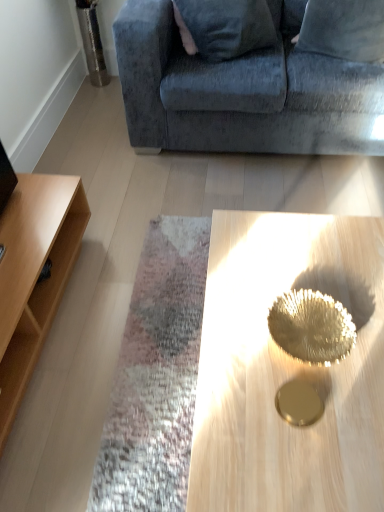
At what (x,y) coordinates should I click in order to perform the action: click on velvet blue couch at upper center. Please return your answer as a coordinate pair (x, y). The height and width of the screenshot is (512, 384). Looking at the image, I should click on (242, 94).

I want to click on velvet blue pillow at upper right, so click(x=344, y=29).

Considering the relative positions of velvet blue pillow at upper right and velvet blue couch at upper center in the image provided, is velvet blue pillow at upper right in front of velvet blue couch at upper center?

No, the depth of velvet blue pillow at upper right is greater than that of velvet blue couch at upper center.

From a real-world perspective, who is located higher, velvet blue pillow at upper right or velvet blue couch at upper center?

In real-world perspective, velvet blue pillow at upper right is above.

Which is correct: velvet blue pillow at upper right is inside velvet blue couch at upper center, or outside of it?

The correct answer is: inside.

Is velvet blue couch at upper center at the back of velvet blue pillow at upper right?

That's right, velvet blue pillow at upper right is facing away from velvet blue couch at upper center.

Who is more distant, gold metallic tray at center or velvet blue couch at upper center?

velvet blue couch at upper center is more distant.

From a real-world perspective, who is located lower, gold metallic tray at center or velvet blue couch at upper center?

From a 3D spatial view, gold metallic tray at center is below.

Find the location of a particular element. The width and height of the screenshot is (384, 512). studio couch above the gold metallic tray at center (from a real-world perspective) is located at coordinates (242, 94).

Does point (378, 258) come closer to viewer compared to point (214, 75)?

Yes, it is.

Which of these two, light wood shelf at left or velvet blue couch at upper center, is thinner?

light wood shelf at left is thinner.

Is light wood shelf at left spatially inside velvet blue couch at upper center, or outside of it?

light wood shelf at left lies outside velvet blue couch at upper center.

Is light wood shelf at left next to velvet blue couch at upper center and touching it?

No, light wood shelf at left is not beside velvet blue couch at upper center.

Is velvet blue pillow at upper right at the left side of gold metallic tray at center?

In fact, velvet blue pillow at upper right is to the right of gold metallic tray at center.

Between velvet blue pillow at upper right and gold metallic tray at center, which one has smaller size?

Smaller between the two is velvet blue pillow at upper right.

From a real-world perspective, which is physically below, velvet blue pillow at upper right or gold metallic tray at center?

gold metallic tray at center.

Is there a large distance between gold metallic tray at center and light wood shelf at left?

gold metallic tray at center is actually quite close to light wood shelf at left.

Considering the relative positions of gold metallic tray at center and light wood shelf at left in the image provided, is gold metallic tray at center to the right of light wood shelf at left from the viewer's perspective?

Yes, gold metallic tray at center is to the right of light wood shelf at left.

Considering the relative sizes of gold metallic tray at center and light wood shelf at left in the image provided, is gold metallic tray at center bigger than light wood shelf at left?

Yes.

From the picture: Which is in front, gold metallic tray at center or light wood shelf at left?

Positioned in front is gold metallic tray at center.

Does velvet blue couch at upper center have a larger size compared to light wood shelf at left?

Yes, velvet blue couch at upper center is bigger than light wood shelf at left.

Is velvet blue couch at upper center facing away from light wood shelf at left?

velvet blue couch at upper center is not turned away from light wood shelf at left.

Is velvet blue couch at upper center positioned behind light wood shelf at left?

Yes.

Considering the sizes of light wood shelf at left and velvet blue pillow at upper right in the image, is light wood shelf at left taller or shorter than velvet blue pillow at upper right?

Clearly, light wood shelf at left is shorter compared to velvet blue pillow at upper right.

Is light wood shelf at left surrounding velvet blue pillow at upper right?

No, velvet blue pillow at upper right is located outside of light wood shelf at left.

Considering the relative sizes of light wood shelf at left and velvet blue pillow at upper right in the image provided, is light wood shelf at left wider than velvet blue pillow at upper right?

Yes, light wood shelf at left is wider than velvet blue pillow at upper right.

Is light wood shelf at left closer to the viewer compared to velvet blue pillow at upper right?

Yes, it is.

You are a GUI agent. You are given a task and a screenshot of the screen. Output one action in this format:
    pyautogui.click(x=<x>, y=<y>)
    Task: Click on the pillow below the velvet blue couch at upper center (from the image's perspective)
    This screenshot has height=512, width=384.
    Given the screenshot: What is the action you would take?
    pyautogui.click(x=344, y=29)

Find the location of a particular element. This screenshot has width=384, height=512. coffee table on the left of velvet blue couch at upper center is located at coordinates (288, 368).

Based on the photo, based on their spatial positions, is gold metallic tray at center or light wood shelf at left further from velvet blue pillow at upper right?

light wood shelf at left is positioned further to the anchor velvet blue pillow at upper right.

Which object lies nearer to the anchor point velvet blue pillow at upper right, velvet blue couch at upper center or light wood shelf at left?

velvet blue couch at upper center.

From the image, which object appears to be farther from light wood shelf at left, velvet blue couch at upper center or velvet blue pillow at upper right?

velvet blue pillow at upper right is further to light wood shelf at left.

From the image, which object appears to be nearer to gold metallic tray at center, velvet blue couch at upper center or light wood shelf at left?

Based on the image, light wood shelf at left appears to be nearer to gold metallic tray at center.

Considering their positions, is light wood shelf at left positioned further to velvet blue couch at upper center than gold metallic tray at center?

gold metallic tray at center.

Based on their spatial positions, is light wood shelf at left or velvet blue pillow at upper right further from gold metallic tray at center?

velvet blue pillow at upper right lies further to gold metallic tray at center than the other object.

Considering their positions, is velvet blue pillow at upper right positioned closer to light wood shelf at left than velvet blue couch at upper center?

Based on the image, velvet blue couch at upper center appears to be nearer to light wood shelf at left.

Considering their positions, is gold metallic tray at center positioned further to velvet blue couch at upper center than velvet blue pillow at upper right?

gold metallic tray at center lies further to velvet blue couch at upper center than the other object.

Identify the location of studio couch located between light wood shelf at left and velvet blue pillow at upper right in the left-right direction. Image resolution: width=384 pixels, height=512 pixels. (242, 94).

Where is `pillow between velvet blue couch at upper center and gold metallic tray at center in the up-down direction`? The width and height of the screenshot is (384, 512). pillow between velvet blue couch at upper center and gold metallic tray at center in the up-down direction is located at coordinates (344, 29).

In order to click on table between velvet blue pillow at upper right and gold metallic tray at center from top to bottom in this screenshot , I will do `click(34, 275)`.

You are a GUI agent. You are given a task and a screenshot of the screen. Output one action in this format:
    pyautogui.click(x=<x>, y=<y>)
    Task: Click on the table between velvet blue couch at upper center and gold metallic tray at center vertically
    This screenshot has height=512, width=384.
    Given the screenshot: What is the action you would take?
    pyautogui.click(x=34, y=275)